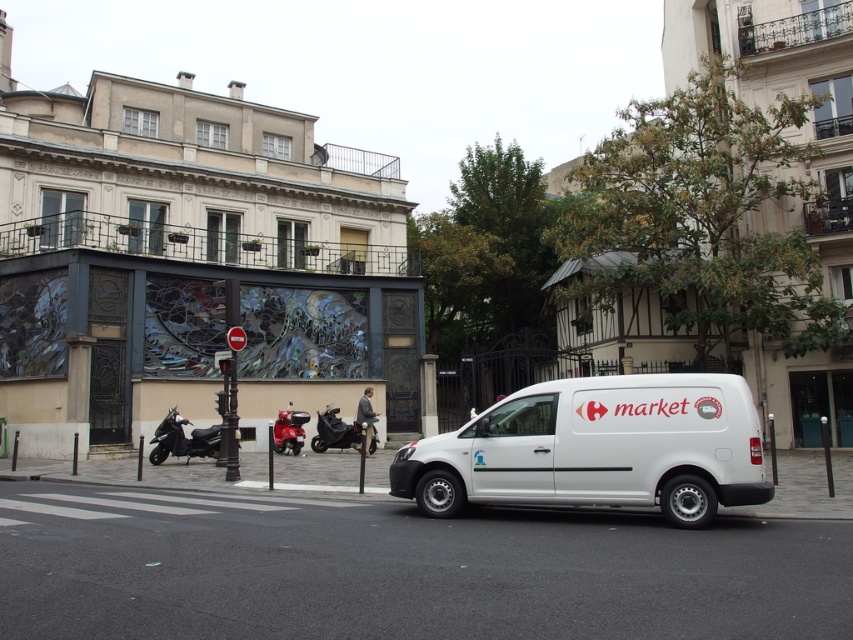
From the picture: Can you confirm if white matte van at center is thinner than shiny black scooter at center?

No, white matte van at center is not thinner than shiny black scooter at center.

Between point (641, 497) and point (323, 445), which one is positioned behind?

Positioned behind is point (323, 445).

This screenshot has height=640, width=853. What are the coordinates of `white matte van at center` in the screenshot? It's located at (598, 449).

Is point (190, 454) positioned after point (280, 432)?

No, it is not.

Where is `shiny black scooter at lower left`? The image size is (853, 640). shiny black scooter at lower left is located at coordinates (184, 440).

Between point (218, 429) and point (302, 413), which one is positioned behind?

Positioned behind is point (302, 413).

In order to click on shiny black scooter at lower left in this screenshot , I will do point(184,440).

Does white matte van at center have a lesser height compared to shiny red motorcycle at center?

No.

Does point (676, 477) come behind point (296, 413)?

No, (676, 477) is closer to viewer.

Does point (677, 513) come in front of point (291, 417)?

That is True.

Find the location of `white matte van at center`. white matte van at center is located at coordinates (598, 449).